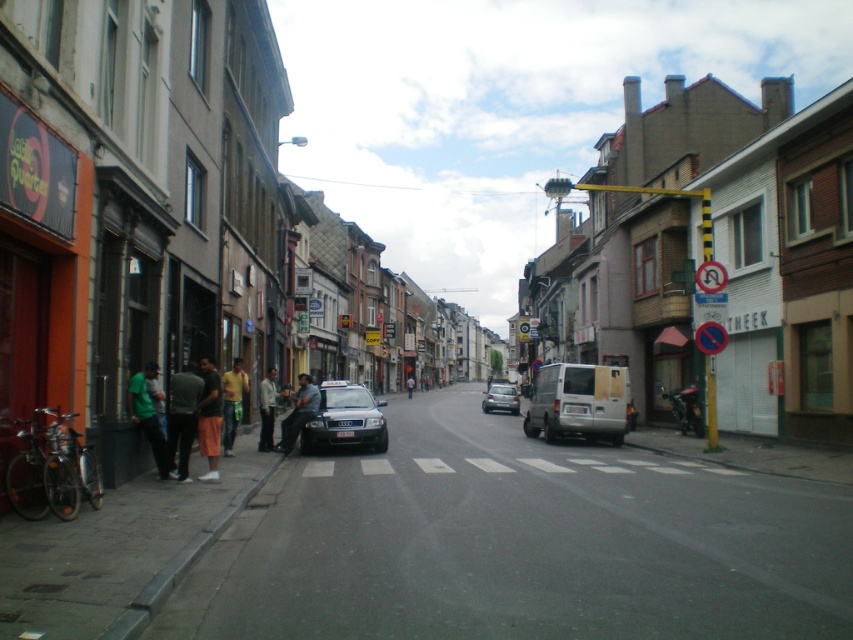
Between silver metallic van at center and green matte shirt at left, which one has more height?

silver metallic van at center

Who is shorter, silver metallic van at center or green matte shirt at left?

green matte shirt at left

Describe the element at coordinates (578, 401) in the screenshot. Image resolution: width=853 pixels, height=640 pixels. I see `silver metallic van at center` at that location.

Locate an element on the screen. silver metallic van at center is located at coordinates (578, 401).

Can you confirm if orange cotton shorts at lower left is positioned below dark blue jeans at center?

Incorrect, orange cotton shorts at lower left is not positioned below dark blue jeans at center.

Is orange cotton shorts at lower left wider than dark blue jeans at center?

In fact, orange cotton shorts at lower left might be narrower than dark blue jeans at center.

At what (x,y) coordinates should I click in order to perform the action: click on orange cotton shorts at lower left. Please return your answer as a coordinate pair (x, y). The height and width of the screenshot is (640, 853). Looking at the image, I should click on (209, 417).

Does green matte shirt at left lie in front of light gray shirt at lower left?

Yes.

Where is `green matte shirt at left`? This screenshot has width=853, height=640. green matte shirt at left is located at coordinates (148, 413).

Which is in front, point (149, 426) or point (265, 388)?

Point (149, 426) is more forward.

Image resolution: width=853 pixels, height=640 pixels. Find the location of `green matte shirt at left`. green matte shirt at left is located at coordinates (148, 413).